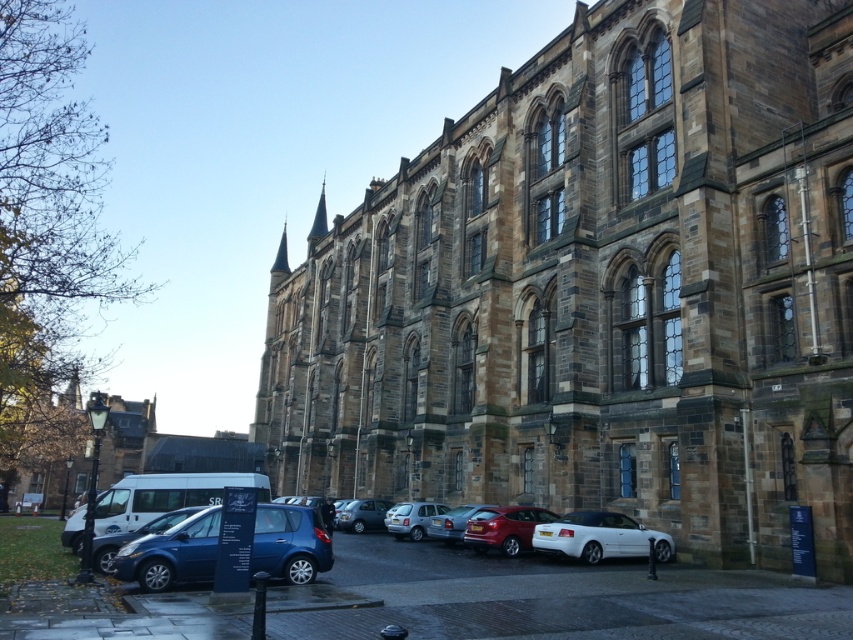
Who is more forward, (572, 515) or (519, 512)?

Point (572, 515) is more forward.

Which of these two, white glossy sedan at lower center or matte red car at center, stands shorter?

With less height is white glossy sedan at lower center.

Locate an element on the screen. The image size is (853, 640). white glossy sedan at lower center is located at coordinates (601, 538).

Who is more forward, (544, 573) or (265, 529)?

Point (265, 529) is more forward.

Measure the distance between point (434,572) and camera.

A distance of 56.71 meters exists between point (434,572) and camera.

Between point (648, 605) and point (149, 589), which one is positioned behind?

The point (149, 589) is behind.

This screenshot has height=640, width=853. In order to click on metallic silver cars at lower center in this screenshot , I will do `click(544, 598)`.

Can you confirm if metallic silver cars at lower center is positioned to the right of white glossy sedan at lower center?

No, metallic silver cars at lower center is not to the right of white glossy sedan at lower center.

What do you see at coordinates (544, 598) in the screenshot? I see `metallic silver cars at lower center` at bounding box center [544, 598].

Does point (585, 588) come closer to viewer compared to point (654, 548)?

Yes, it is in front of point (654, 548).

I want to click on metallic silver cars at lower center, so click(544, 598).